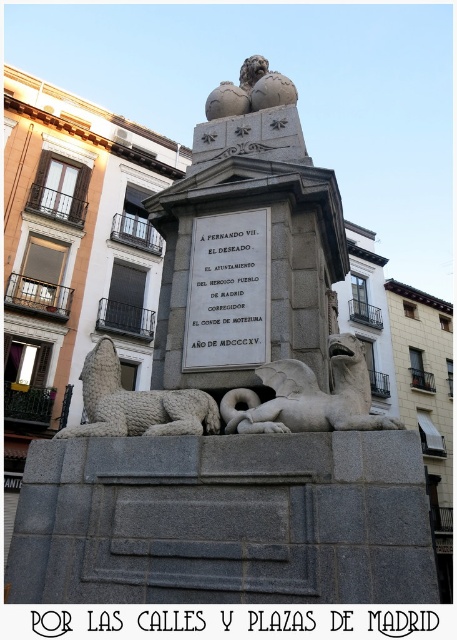
You are a tour guide leading a group through the square and want to ensure everyone can see both the white stone gryphon at lower center and the white stone lion at lower left clearly. The average person can see objects clearly up to 5 meters away. Can the entire group view both statues without moving closer?

The white stone gryphon at lower center and the white stone lion at lower left are 4.27 meters apart. Since the distance between them is within the 5 meters clear viewing range, the entire group can view both statues without moving closer.

You are standing in the city square in front of the monument. You notice two points marked on the monument. The first point is at coordinate point [237,260] and the second is at point [341,376]. From your perspective, which point is closer to you?

Point [341,376] is closer to you because it is in front of point [237,260] according to their spatial arrangement.